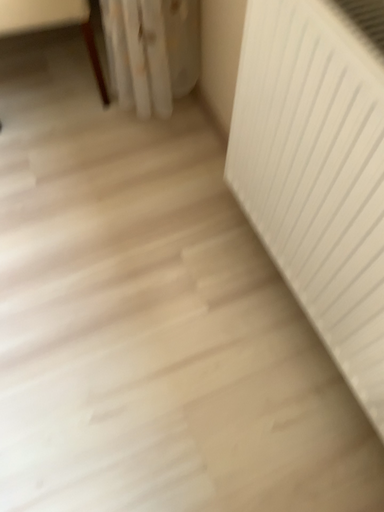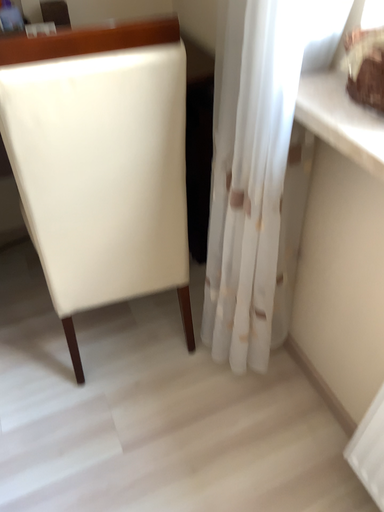
Question: Which way did the camera rotate in the video?

Choices:
 (A) rotated upward
 (B) rotated downward

Answer: (A)